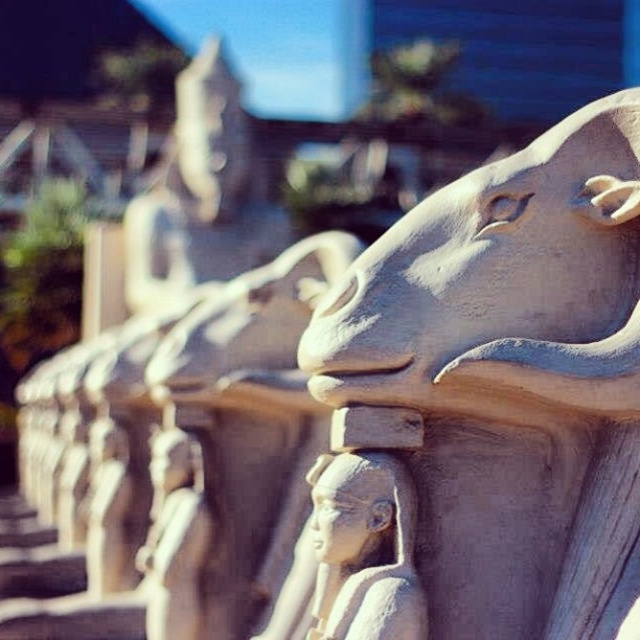
Consider the image. You are an archaeologist examining the statues in the image. You notice the gray stone bull at center and the white stone head at center. Which one is located higher up in the image?

The gray stone bull at center is located above the white stone head at center, so it is higher up in the image.

You are a photographer standing 50 inches away from a gray stone bull at center. You want to take a clear photo of it. Do you need to move closer or farther away?

The gray stone bull at center is 33.35 inches from the camera. Since you are currently 50 inches away, you need to move closer by approximately 16.65 inches to reach the correct distance.